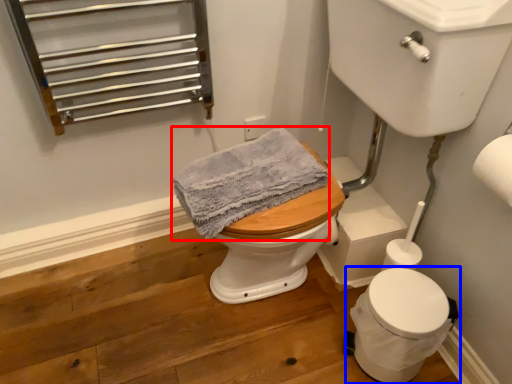
Question: Which object appears closest to the camera in this image, bath towel (highlighted by a red box) or toilet (highlighted by a blue box)?

Choices:
 (A) bath towel
 (B) toilet

Answer: (A)